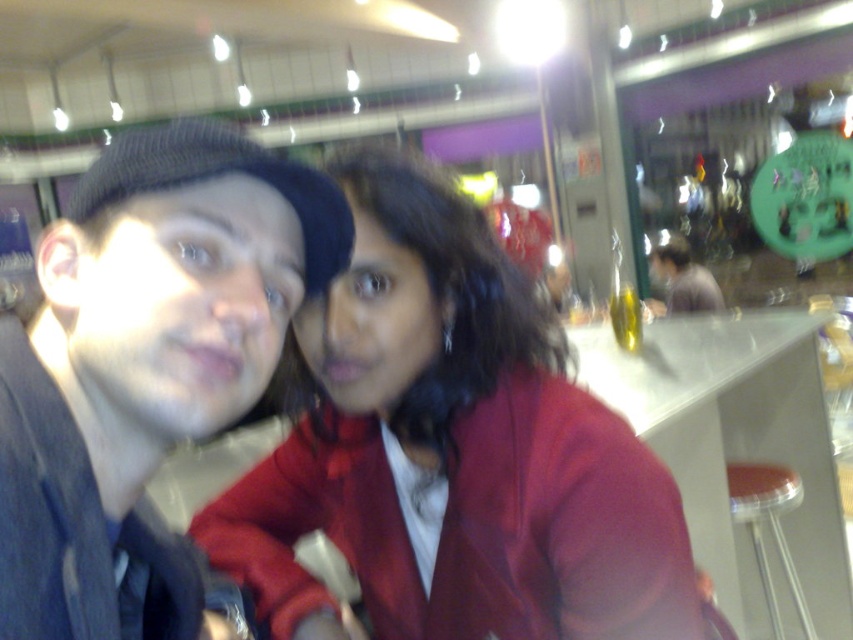
You are taking a photo of two people wearing the matte red jacket at center and the matte gray shirt at center. Which clothing item will appear shorter in the photo?

The matte red jacket at center will appear shorter in the photo because it is not as tall as the matte gray shirt at center.

You are standing at point (318, 344) and want to take a selfie with two friends who are 68.83 centimeters away from you. Can you fit both of them in the frame if your camera has a maximum angle of 60 degrees?

Yes, because the distance between you and your friends is 68.83 centimeters, and with a 60 degree angle camera, the field of view would be sufficient to capture both individuals within the frame.

You are taking a photo of two people wearing the matte red jacket at center and the matte gray shirt at center. Which clothing item will appear more prominent in the photo?

The matte red jacket at center is in front of the matte gray shirt at center, so it will appear more prominent in the photo.